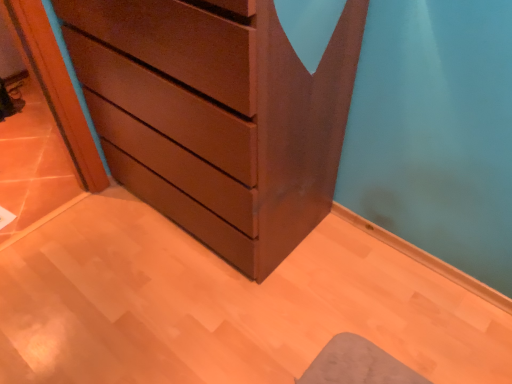
Where is `free space in front of matte brown chest of drawers at center`? This screenshot has height=384, width=512. free space in front of matte brown chest of drawers at center is located at coordinates (208, 313).